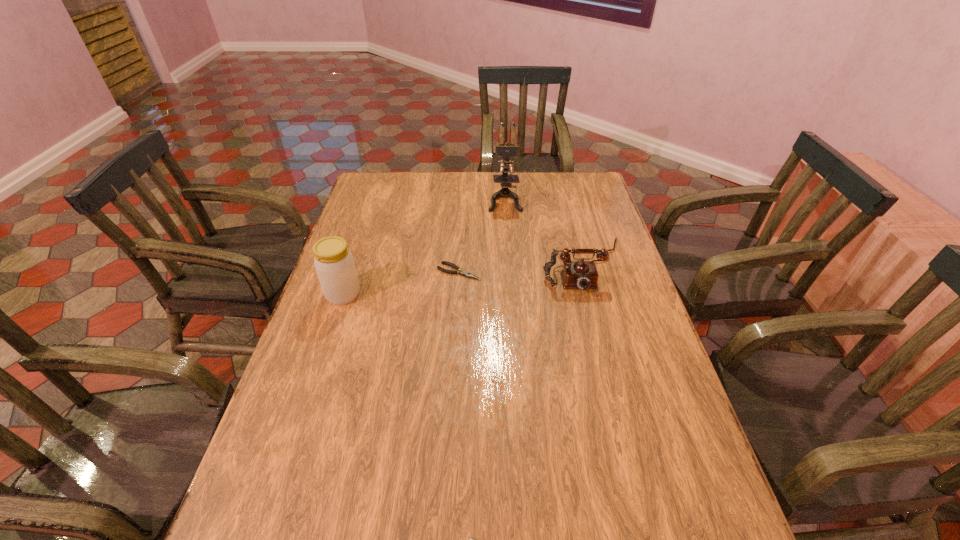
At what (x,y) coordinates should I click in order to perform the action: click on the farthest object. Please return your answer as a coordinate pair (x, y). The height and width of the screenshot is (540, 960). Looking at the image, I should click on (504, 149).

Where is `microscope`? The image size is (960, 540). microscope is located at coordinates (504, 149).

Locate an element on the screen. The width and height of the screenshot is (960, 540). the leftmost object is located at coordinates (334, 263).

At what (x,y) coordinates should I click in order to perform the action: click on jar. Please return your answer as a coordinate pair (x, y). This screenshot has width=960, height=540. Looking at the image, I should click on (334, 263).

Identify the location of the rightmost object. This screenshot has height=540, width=960. (579, 274).

Locate an element on the screen. This screenshot has height=540, width=960. telephone is located at coordinates (579, 274).

Find the location of `the farther pliers`. the farther pliers is located at coordinates (463, 273).

You are a GUI agent. You are given a task and a screenshot of the screen. Output one action in this format:
    pyautogui.click(x=<x>, y=<y>)
    Task: Click on the vacant space located 0.170m at the eyepieces of the farthest object
    The width and height of the screenshot is (960, 540).
    Given the screenshot: What is the action you would take?
    pyautogui.click(x=508, y=240)

The image size is (960, 540). What are the coordinates of `vacant area situated 0.060m on the right of the jar` in the screenshot? It's located at (381, 294).

The image size is (960, 540). Find the location of `free location located 0.390m on the dial of the rightmost object`. free location located 0.390m on the dial of the rightmost object is located at coordinates (624, 416).